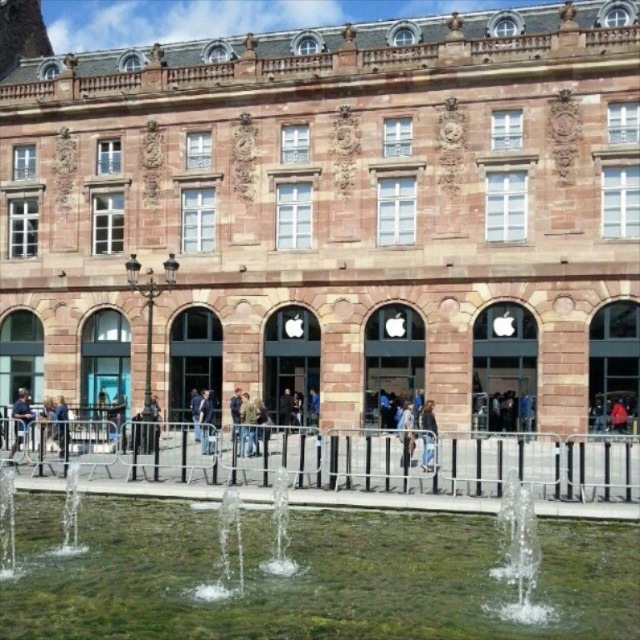
Between clear glass water at lower center and light brown leather jacket at center, which one appears on the left side from the viewer's perspective?

Positioned to the left is light brown leather jacket at center.

Between point (508, 488) and point (422, 422), which one is positioned behind?

The point (422, 422) is more distant.

Locate an element on the screen. clear glass water at lower center is located at coordinates (518, 554).

Does light brown leather jacket at center have a lesser height compared to blue denim jeans at center?

Correct, light brown leather jacket at center is not as tall as blue denim jeans at center.

This screenshot has height=640, width=640. What are the coordinates of `light brown leather jacket at center` in the screenshot? It's located at (428, 435).

Measure the distance between point (429, 449) and camera.

168.49 feet

At what (x,y) coordinates should I click in order to perform the action: click on light brown leather jacket at center. Please return your answer as a coordinate pair (x, y). This screenshot has width=640, height=640. Looking at the image, I should click on pos(428,435).

Who is more distant from viewer, (429, 413) or (65, 401)?

The point (65, 401) is behind.

Does light brown leather jacket at center have a lesser width compared to dark blue fabric at center?

Yes, light brown leather jacket at center is thinner than dark blue fabric at center.

Identify the location of light brown leather jacket at center. (428, 435).